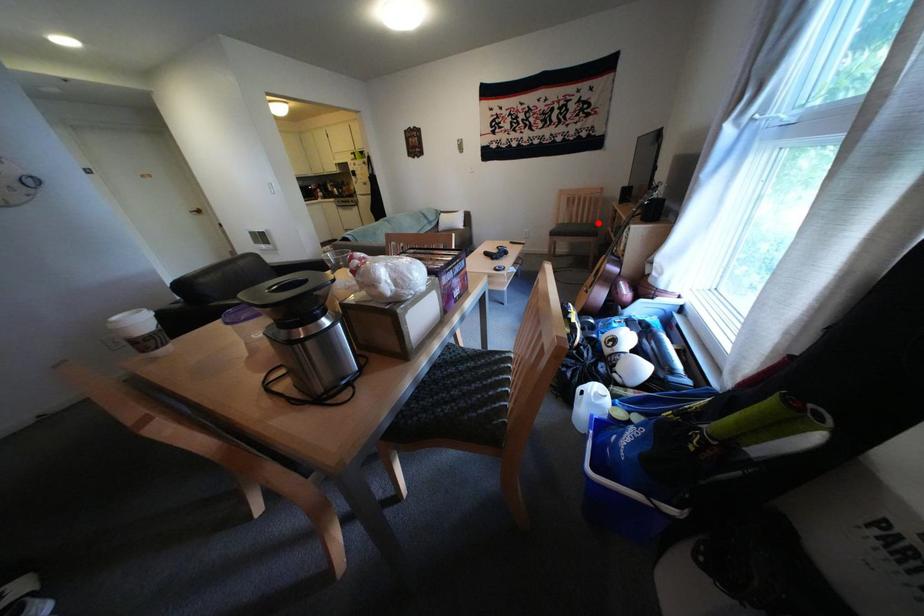
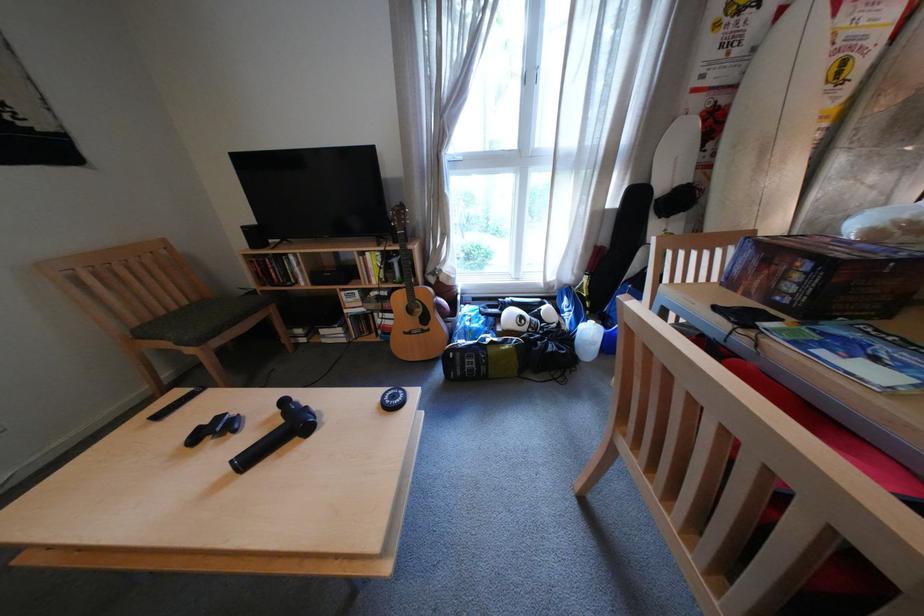
Where in the second image is the point corresponding to the highlighted location from the first image?

(199, 304)